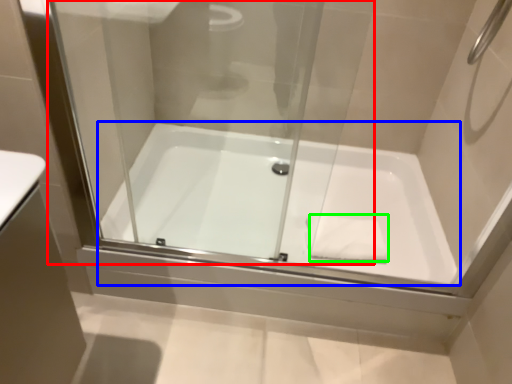
Question: Considering the real-world distances, which object is closest to glass door (highlighted by a red box)? bathtub (highlighted by a blue box) or hand towel (highlighted by a green box).

Choices:
 (A) bathtub
 (B) hand towel

Answer: (A)